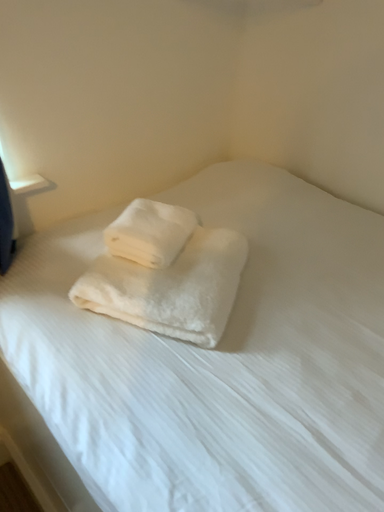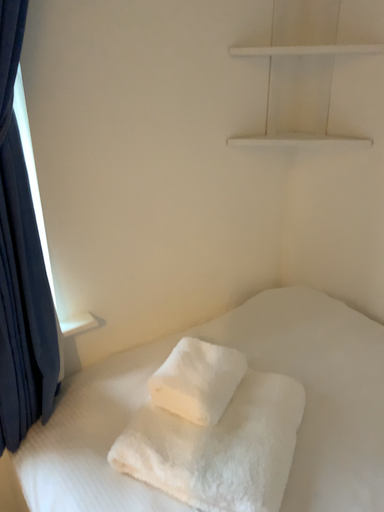
Question: How did the camera likely rotate when shooting the video?

Choices:
 (A) rotated left
 (B) rotated right

Answer: (A)